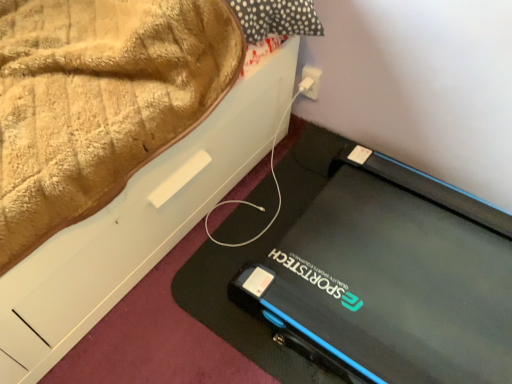
Question: Can you confirm if black rubber mat at lower right is shorter than white plastic plug at upper right?

Choices:
 (A) no
 (B) yes

Answer: (B)

Question: Is black rubber mat at lower right outside of white plastic plug at upper right?

Choices:
 (A) no
 (B) yes

Answer: (B)

Question: Considering the relative positions of black rubber mat at lower right and white plastic plug at upper right in the image provided, is black rubber mat at lower right to the right of white plastic plug at upper right from the viewer's perspective?

Choices:
 (A) yes
 (B) no

Answer: (B)

Question: Is the position of black rubber mat at lower right more distant than that of white plastic plug at upper right?

Choices:
 (A) no
 (B) yes

Answer: (A)

Question: Does black rubber mat at lower right have a lesser width compared to white plastic plug at upper right?

Choices:
 (A) no
 (B) yes

Answer: (A)

Question: Are black rubber mat at lower right and white plastic plug at upper right making contact?

Choices:
 (A) no
 (B) yes

Answer: (A)

Question: Does white plastic plug at upper right have a lesser height compared to black rubber mat at lower right?

Choices:
 (A) yes
 (B) no

Answer: (B)

Question: Can black rubber mat at lower right be found inside white plastic plug at upper right?

Choices:
 (A) no
 (B) yes

Answer: (A)

Question: Can you see white plastic plug at upper right touching black rubber mat at lower right?

Choices:
 (A) yes
 (B) no

Answer: (B)

Question: Could you tell me if white plastic plug at upper right is facing black rubber mat at lower right?

Choices:
 (A) yes
 (B) no

Answer: (A)

Question: Is white plastic plug at upper right smaller than black rubber mat at lower right?

Choices:
 (A) no
 (B) yes

Answer: (B)

Question: From a real-world perspective, is white plastic plug at upper right located beneath black rubber mat at lower right?

Choices:
 (A) no
 (B) yes

Answer: (A)

Question: Is black rubber mat at lower right spatially inside white plastic plug at upper right, or outside of it?

Choices:
 (A) outside
 (B) inside

Answer: (A)